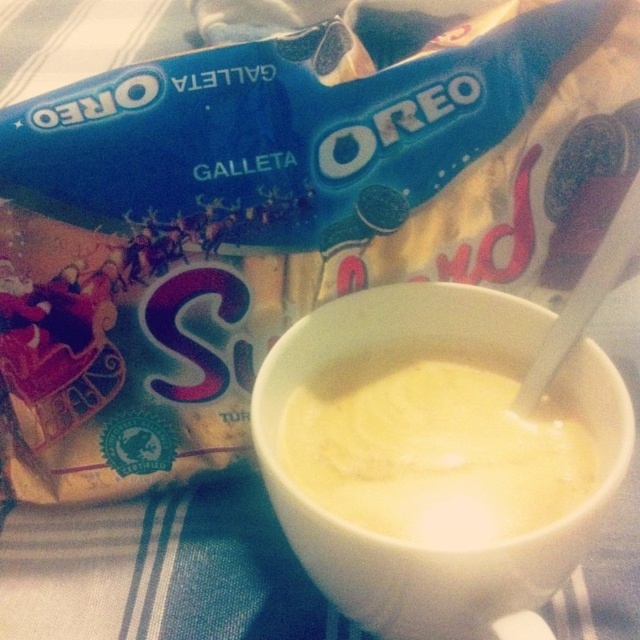
Between point (301, 536) and point (397, 445), which one is positioned behind?

Point (397, 445)

Is yellow creamy liquid at center to the left of yellow creamy soup at center from the viewer's perspective?

Correct, you'll find yellow creamy liquid at center to the left of yellow creamy soup at center.

What do you see at coordinates (412, 545) in the screenshot?
I see `yellow creamy liquid at center` at bounding box center [412, 545].

Identify the location of yellow creamy liquid at center. (412, 545).